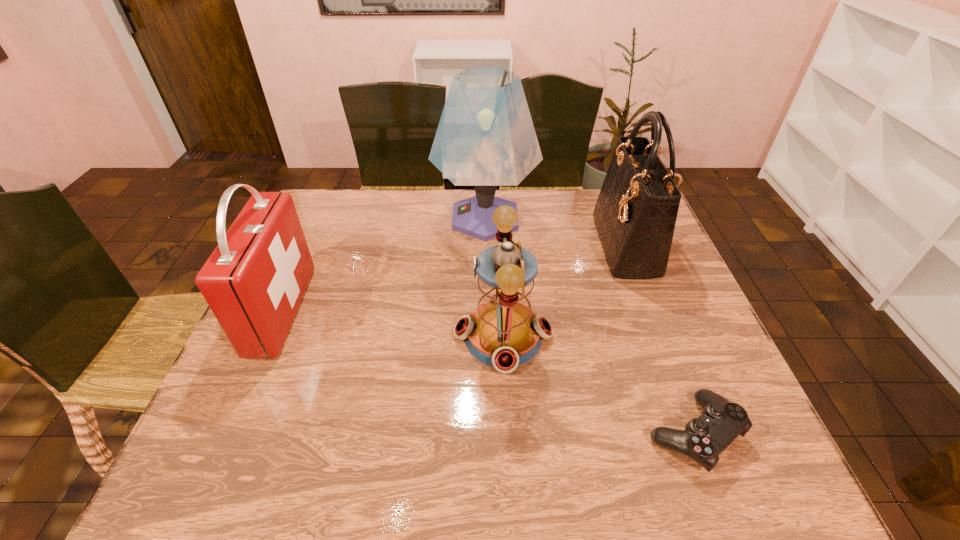
This screenshot has width=960, height=540. I want to click on lampshade, so click(485, 138).

This screenshot has width=960, height=540. Identify the location of handbag. (635, 214).

I want to click on the first-aid kit, so click(254, 281).

Image resolution: width=960 pixels, height=540 pixels. I want to click on the second shortest object, so click(x=503, y=332).

Identify the location of control. (704, 438).

I want to click on the nearest object, so click(704, 438).

Locate an element on the screen. The image size is (960, 540). vacant point located 0.240m on the base of the lampshade is located at coordinates (359, 218).

I want to click on free region located 0.140m on the base of the lampshade, so pos(390,218).

Where is `vacant space located 0.250m on the base of the lampshade`? The width and height of the screenshot is (960, 540). vacant space located 0.250m on the base of the lampshade is located at coordinates (356, 218).

The width and height of the screenshot is (960, 540). I want to click on vacant space located 0.070m at the front of the handbag with visible charms, so click(577, 246).